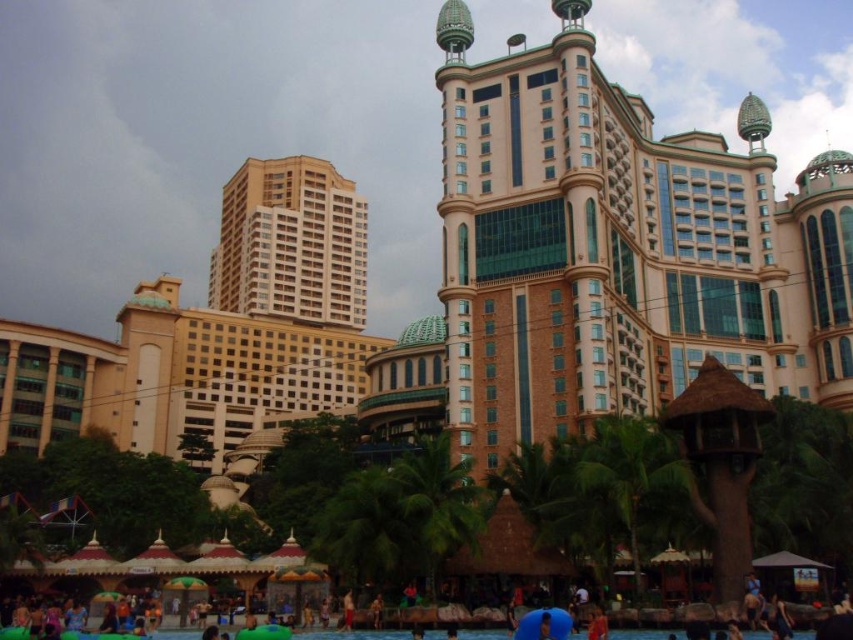
You are standing at the entrance of the urban landscape and want to locate the blue rubber pool at lower center. According to the scene, which direction should you look relative to the beige glass building at center?

The beige glass building at center is to the left of the blue rubber pool at lower center, so you should look to the right of the beige glass building at center to find the blue rubber pool at lower center.

You are standing at the entrance of the beige glass building at center and want to reach the blue rubber pool at lower center. Which direction should you move to get there?

The beige glass building at center is located above the blue rubber pool at lower center, so you should move downward to reach the blue rubber pool at lower center.